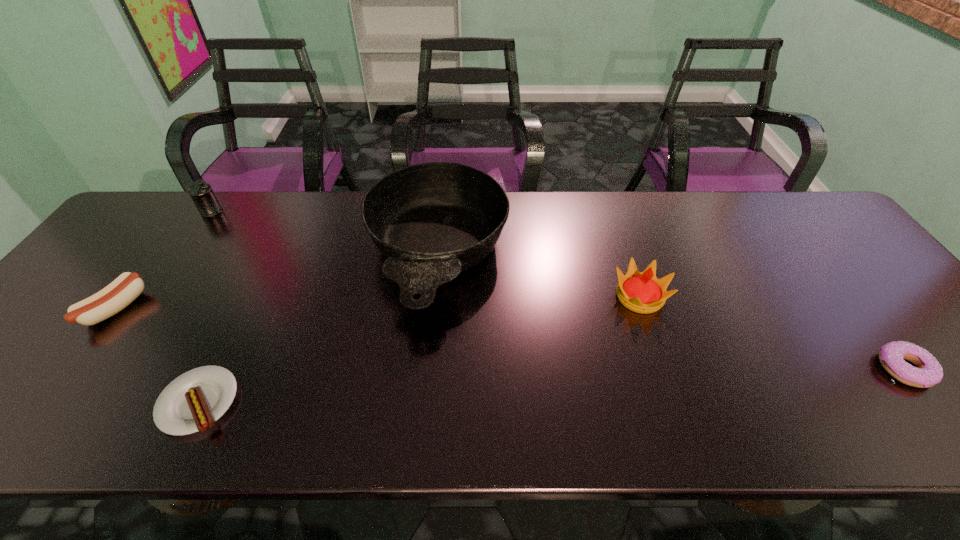
Identify the location of vacant space located 0.400m on the left of the crown. Image resolution: width=960 pixels, height=540 pixels. (453, 297).

Where is `free space located 0.390m on the right of the can`? Image resolution: width=960 pixels, height=540 pixels. free space located 0.390m on the right of the can is located at coordinates (348, 212).

At what (x,y) coordinates should I click in order to perform the action: click on free space located 0.260m on the back of the fourth tallest object. Please return your answer as a coordinate pair (x, y). The height and width of the screenshot is (540, 960). Looking at the image, I should click on (180, 222).

You are a GUI agent. You are given a task and a screenshot of the screen. Output one action in this format:
    pyautogui.click(x=<x>, y=<y>)
    Task: Click on the free space located 0.250m on the left of the rightmost object
    
    Given the screenshot: What is the action you would take?
    pyautogui.click(x=766, y=369)

Locate an element on the screen. This screenshot has height=540, width=960. vacant space located on the back of the right sausage is located at coordinates (256, 284).

Find the location of a particular element. frying pan present at the far edge is located at coordinates (431, 221).

The height and width of the screenshot is (540, 960). In order to click on can that is at the far edge in this screenshot , I will do click(201, 193).

Locate an element on the screen. The height and width of the screenshot is (540, 960). object located at the near edge is located at coordinates (194, 401).

Image resolution: width=960 pixels, height=540 pixels. What are the coordinates of `object located in the left edge section of the desktop` in the screenshot? It's located at (116, 296).

The width and height of the screenshot is (960, 540). Identify the location of object that is at the right edge. (928, 372).